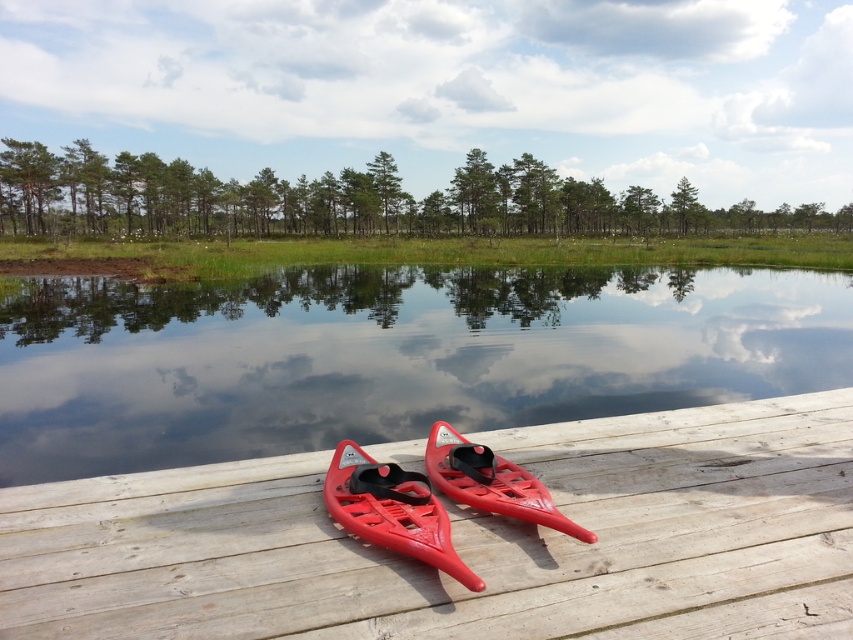
Question: Which object is closer to the camera taking this photo?

Choices:
 (A) matte red canoe at center
 (B) transparent water at center

Answer: (A)

Question: Among these points, which one is nearest to the camera?

Choices:
 (A) (512, 352)
 (B) (838, 630)
 (C) (379, 509)

Answer: (B)

Question: Observing the image, what is the correct spatial positioning of matte wood dock at center in reference to glossy plastic canoe at center?

Choices:
 (A) left
 (B) right

Answer: (B)

Question: Which point is farther to the camera?

Choices:
 (A) matte wood dock at center
 (B) matte red canoe at center

Answer: (B)

Question: Where is matte wood dock at center located in relation to transparent water at center in the image?

Choices:
 (A) above
 (B) below

Answer: (B)

Question: Does matte red canoe at center have a larger size compared to glossy plastic canoe at center?

Choices:
 (A) no
 (B) yes

Answer: (B)